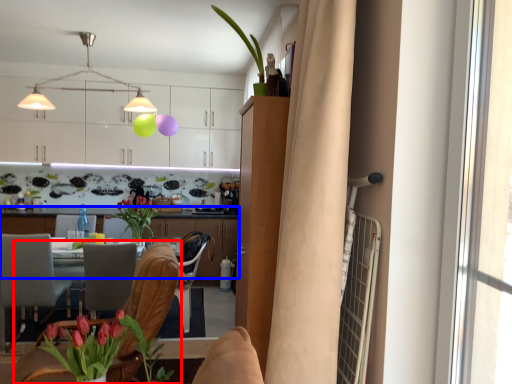
Question: Which of the following is the closest to the observer, chair (highlighted by a red box) or cabinetry (highlighted by a blue box)?

Choices:
 (A) chair
 (B) cabinetry

Answer: (A)